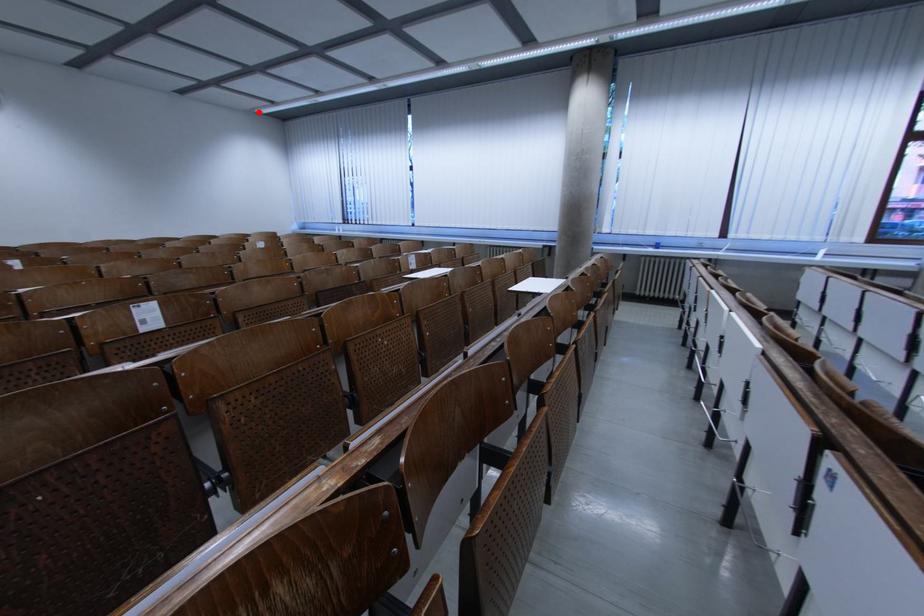
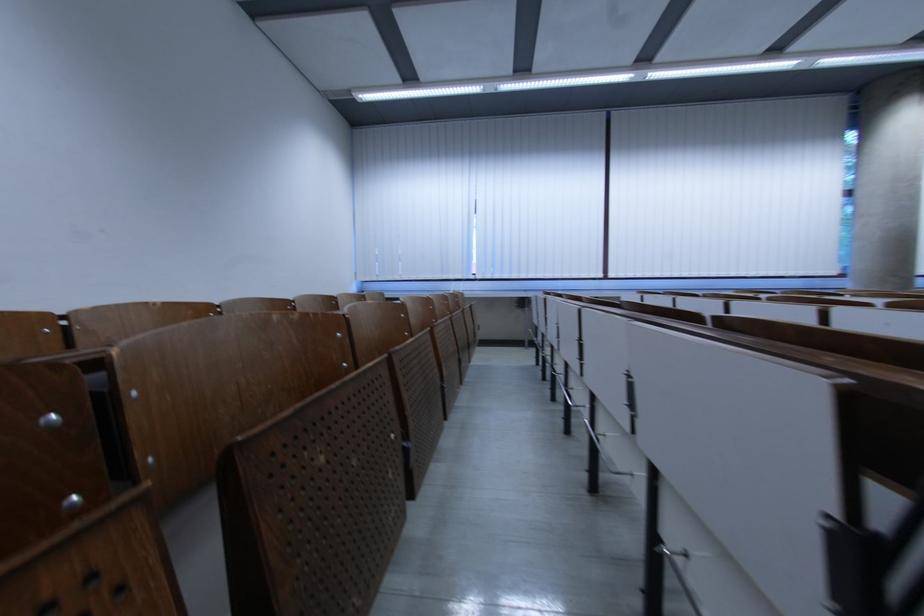
Find the pixel in the second image that matches the highlighted location in the first image.

(354, 92)